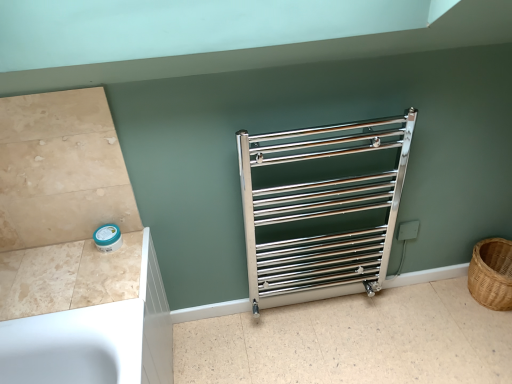
I want to click on free space above beige marble counter top at lower left (from a real-world perspective), so click(x=65, y=272).